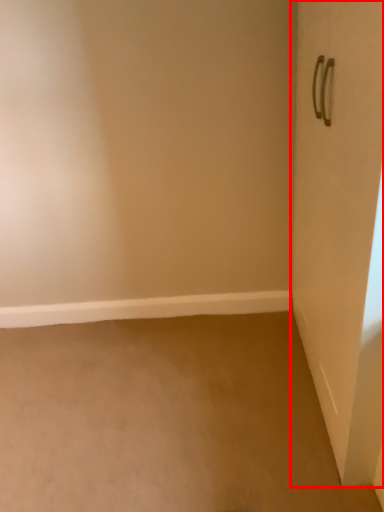
Question: From the image's perspective, considering the relative positions of door (annotated by the red box) and window sill in the image provided, where is door (annotated by the red box) located with respect to the staircase?

Choices:
 (A) below
 (B) above

Answer: (B)